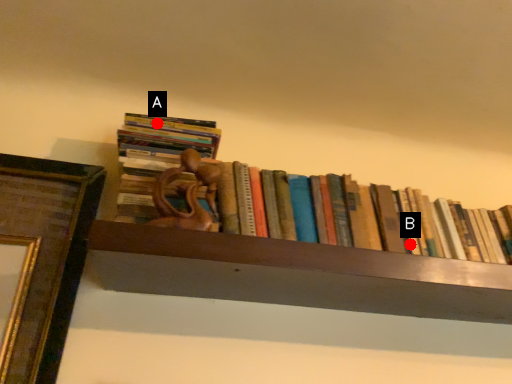
Question: Two points are circled on the image, labeled by A and B beside each circle. Among these points, which one is farthest from the camera?

Choices:
 (A) A is further
 (B) B is further

Answer: (A)